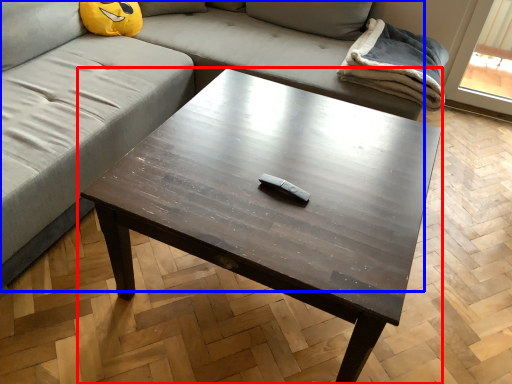
Question: Which object is closer to the camera taking this photo, coffee table (highlighted by a red box) or studio couch (highlighted by a blue box)?

Choices:
 (A) coffee table
 (B) studio couch

Answer: (B)